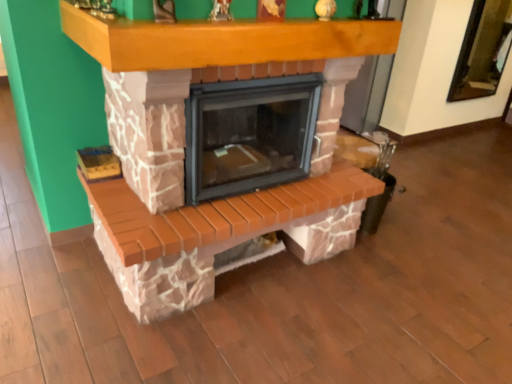
Question: Is point (128, 170) positioned closer to the camera than point (232, 51)?

Choices:
 (A) farther
 (B) closer

Answer: (A)

Question: From a real-world perspective, is brick fireplace at center physically located above or below wooden mantle at upper center?

Choices:
 (A) below
 (B) above

Answer: (A)

Question: In the image, is brick fireplace at center positioned in front of or behind wooden mantle at upper center?

Choices:
 (A) front
 (B) behind

Answer: (B)

Question: Is point (229, 57) closer or farther from the camera than point (220, 79)?

Choices:
 (A) closer
 (B) farther

Answer: (A)

Question: Choose the correct answer: Is wooden mantle at upper center inside brick fireplace at center or outside it?

Choices:
 (A) inside
 (B) outside

Answer: (B)

Question: From a real-world perspective, relative to brick fireplace at center, is wooden mantle at upper center vertically above or below?

Choices:
 (A) above
 (B) below

Answer: (A)

Question: Considering the relative positions of wooden mantle at upper center and brick fireplace at center in the image provided, is wooden mantle at upper center to the left or to the right of brick fireplace at center?

Choices:
 (A) left
 (B) right

Answer: (B)